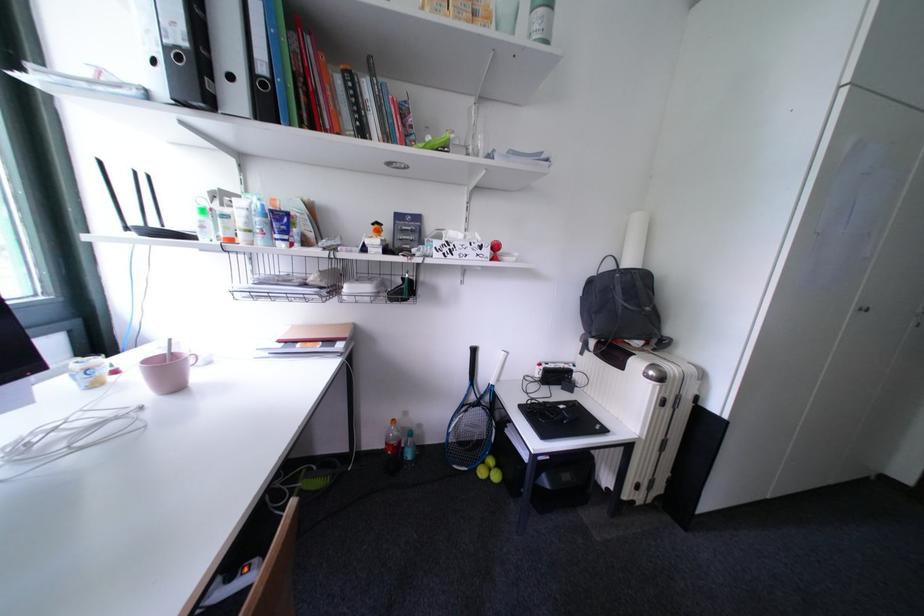
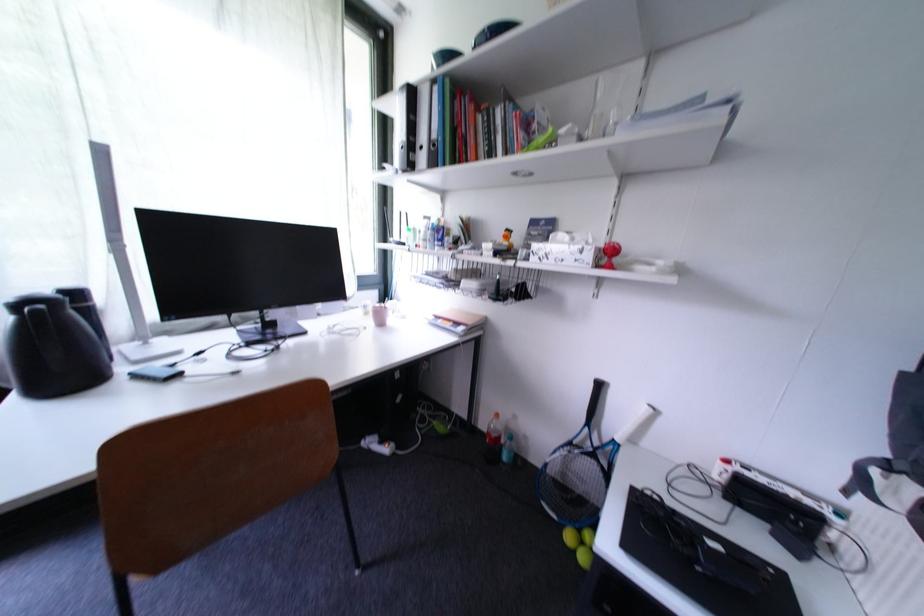
In the second image, find the point that corresponds to pixel 496 480 in the first image.

(582, 554)